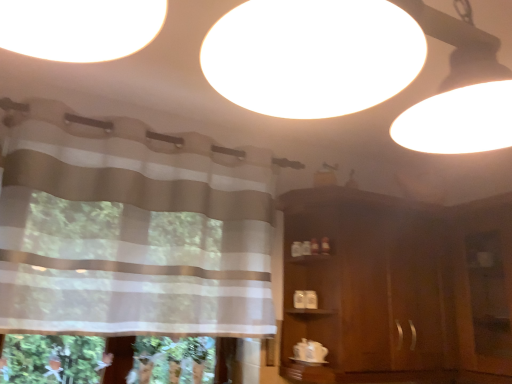
Question: Considering their positions, is transparent plastic screen door at right located in front of or behind striped fabric curtain at upper left?

Choices:
 (A) behind
 (B) front

Answer: (A)

Question: Considering the positions of transparent plastic screen door at right and striped fabric curtain at upper left in the image, is transparent plastic screen door at right taller or shorter than striped fabric curtain at upper left?

Choices:
 (A) tall
 (B) short

Answer: (A)

Question: Considering the real-world distances, which object is farthest from the striped fabric curtain at upper left?

Choices:
 (A) brown wooden dresser at right
 (B) transparent plastic screen door at right

Answer: (B)

Question: Based on their relative distances, which object is farther from the striped fabric curtain at upper left?

Choices:
 (A) transparent plastic screen door at right
 (B) brown wooden dresser at right

Answer: (A)